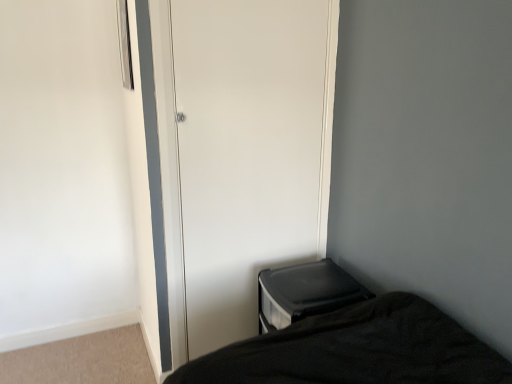
Question: In terms of height, does black plastic changing table at lower right look taller or shorter compared to white glossy door at center?

Choices:
 (A) short
 (B) tall

Answer: (A)

Question: Is black plastic changing table at lower right bigger or smaller than white glossy door at center?

Choices:
 (A) small
 (B) big

Answer: (B)

Question: Does point (348, 279) appear closer or farther from the camera than point (250, 84)?

Choices:
 (A) farther
 (B) closer

Answer: (A)

Question: Is white glossy door at center situated inside black plastic changing table at lower right or outside?

Choices:
 (A) inside
 (B) outside

Answer: (B)

Question: Visually, is white glossy door at center positioned to the left or to the right of black plastic changing table at lower right?

Choices:
 (A) left
 (B) right

Answer: (A)

Question: From the image's perspective, is white glossy door at center above or below black plastic changing table at lower right?

Choices:
 (A) above
 (B) below

Answer: (A)

Question: Considering the positions of white glossy door at center and black plastic changing table at lower right in the image, is white glossy door at center wider or thinner than black plastic changing table at lower right?

Choices:
 (A) wide
 (B) thin

Answer: (B)